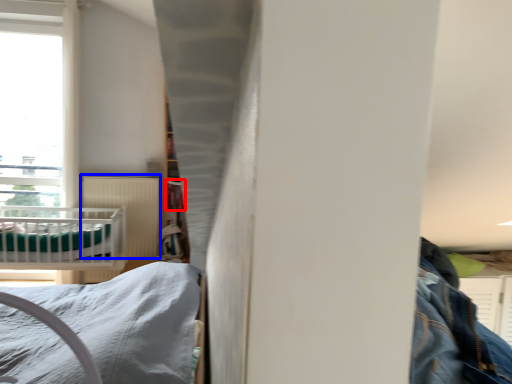
Question: Among these objects, which one is nearest to the camera, shelf (highlighted by a red box) or radiator (highlighted by a blue box)?

Choices:
 (A) shelf
 (B) radiator

Answer: (B)